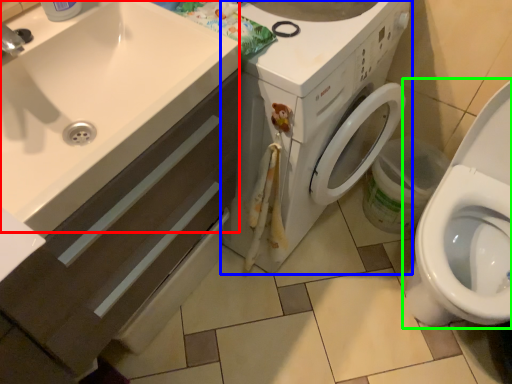
Question: Considering the real-world distances, which object is farthest from sink (highlighted by a red box)? washing machine (highlighted by a blue box) or toilet (highlighted by a green box)?

Choices:
 (A) washing machine
 (B) toilet

Answer: (B)